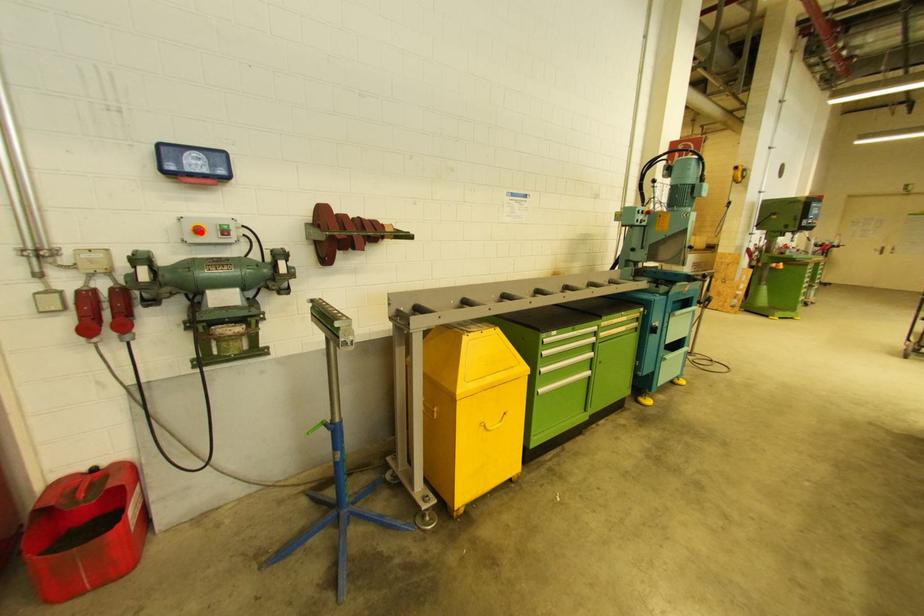
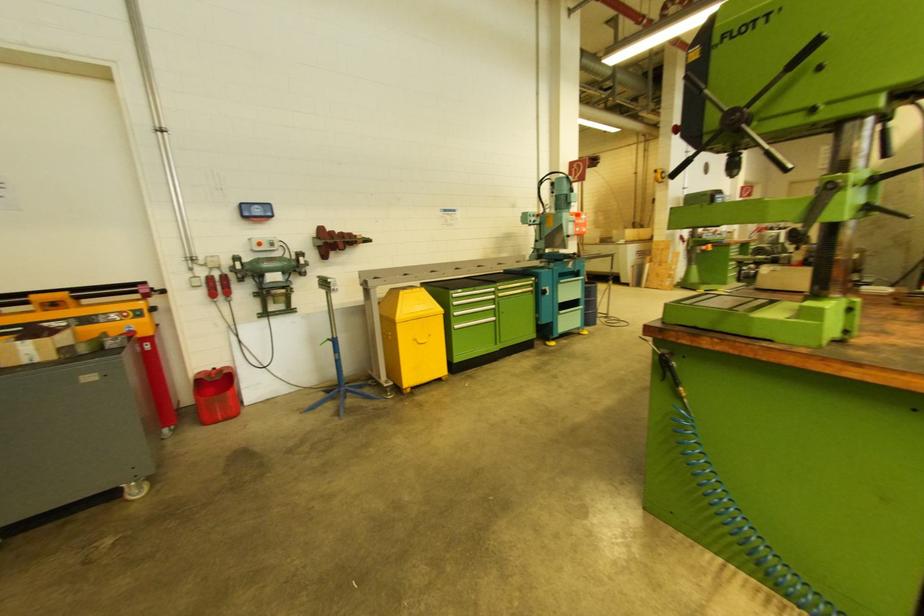
Find the pixel in the second image that matches the highlighted location in the first image.

(261, 246)